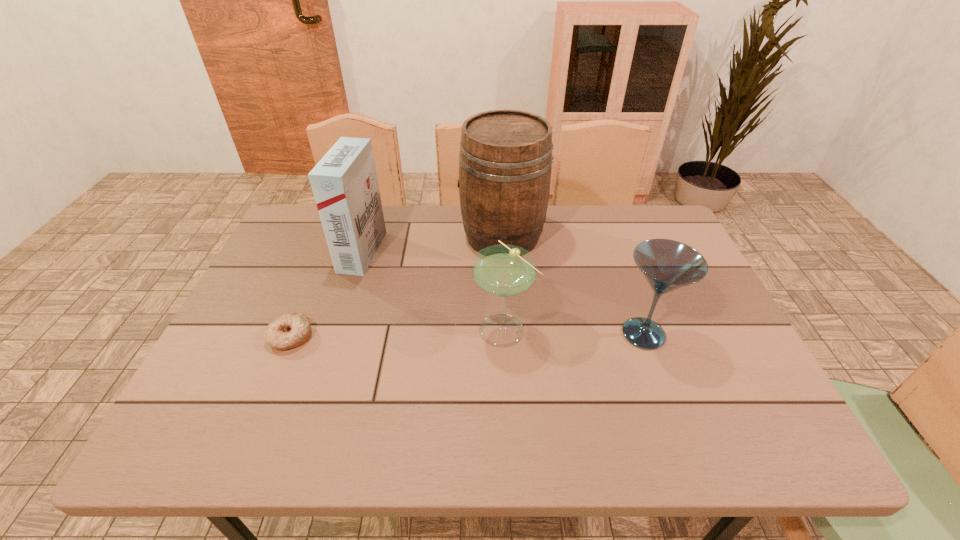
You are a GUI agent. You are given a task and a screenshot of the screen. Output one action in this format:
    pyautogui.click(x=<x>, y=<y>)
    Task: Click on the free space located on the back of the left martini
    The width and height of the screenshot is (960, 540).
    Given the screenshot: What is the action you would take?
    point(500,258)

Locate an element on the screen. The image size is (960, 540). free region located 0.080m on the right of the shortest object is located at coordinates (347, 337).

Image resolution: width=960 pixels, height=540 pixels. I want to click on cider at the far edge, so click(x=505, y=161).

You are a GUI agent. You are given a task and a screenshot of the screen. Output one action in this format:
    pyautogui.click(x=<x>, y=<y>)
    Task: Click on the cigarette case located at the far edge
    
    Given the screenshot: What is the action you would take?
    pyautogui.click(x=344, y=182)

Identify the location of object that is at the left edge. This screenshot has height=540, width=960. (290, 330).

This screenshot has width=960, height=540. What are the coordinates of `object that is at the right edge` in the screenshot? It's located at (667, 265).

I want to click on free spot at the far edge of the desktop, so click(603, 216).

Find the location of `vacant space at the near edge of the desktop`. vacant space at the near edge of the desktop is located at coordinates (307, 447).

In order to click on free space at the left edge of the desktop in this screenshot , I will do `click(263, 401)`.

This screenshot has height=540, width=960. In order to click on free space at the right edge of the desktop in this screenshot , I will do pos(708,337).